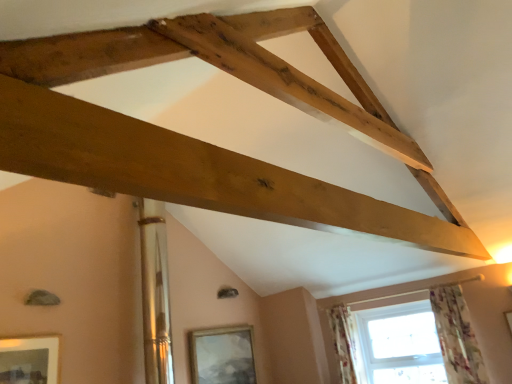
Question: Is floral fabric curtain at lower right, marked as the first curtain in a back-to-front arrangement, located within floral fabric curtain at lower right, the first curtain when ordered from front to back?

Choices:
 (A) yes
 (B) no

Answer: (B)

Question: Can you confirm if floral fabric curtain at lower right, the 1th curtain when ordered from right to left, is taller than floral fabric curtain at lower right, arranged as the second curtain when viewed from the front?

Choices:
 (A) yes
 (B) no

Answer: (A)

Question: From the image's perspective, would you say floral fabric curtain at lower right, the first curtain when ordered from front to back, is shown under floral fabric curtain at lower right, marked as the first curtain in a back-to-front arrangement?

Choices:
 (A) yes
 (B) no

Answer: (B)

Question: Could you tell me if floral fabric curtain at lower right, placed as the 2th curtain when sorted from back to front, is facing floral fabric curtain at lower right, positioned as the second curtain in right-to-left order?

Choices:
 (A) yes
 (B) no

Answer: (B)

Question: Does floral fabric curtain at lower right, placed as the 2th curtain when sorted from back to front, have a greater width compared to floral fabric curtain at lower right, marked as the first curtain in a back-to-front arrangement?

Choices:
 (A) no
 (B) yes

Answer: (A)

Question: Is floral fabric curtain at lower right, placed as the 2th curtain when sorted from back to front, touching floral fabric curtain at lower right, marked as the first curtain in a back-to-front arrangement?

Choices:
 (A) yes
 (B) no

Answer: (B)

Question: Is matte silver picture frame at lower center, acting as the 1th picture frame starting from the bottom, surrounding matte gold picture frame at lower left, the second picture frame from the bottom?

Choices:
 (A) no
 (B) yes

Answer: (A)

Question: From a real-world perspective, is matte silver picture frame at lower center, acting as the 1th picture frame starting from the bottom, positioned under matte gold picture frame at lower left, the first picture frame in the front-to-back sequence, based on gravity?

Choices:
 (A) yes
 (B) no

Answer: (A)

Question: Considering the relative sizes of matte silver picture frame at lower center, positioned as the 1th picture frame in back-to-front order, and matte gold picture frame at lower left, positioned as the 1th picture frame in left-to-right order, in the image provided, is matte silver picture frame at lower center, positioned as the 1th picture frame in back-to-front order, thinner than matte gold picture frame at lower left, positioned as the 1th picture frame in left-to-right order,?

Choices:
 (A) yes
 (B) no

Answer: (B)

Question: Is matte silver picture frame at lower center, which is counted as the 1th picture frame, starting from the right, outside matte gold picture frame at lower left, positioned as the 1th picture frame in left-to-right order?

Choices:
 (A) yes
 (B) no

Answer: (A)

Question: Is there a large distance between matte silver picture frame at lower center, placed as the second picture frame when sorted from front to back, and matte gold picture frame at lower left, which appears as the 2th picture frame when viewed from the back?

Choices:
 (A) yes
 (B) no

Answer: (A)

Question: From a real-world perspective, is matte silver picture frame at lower center, positioned as the 1th picture frame in back-to-front order, positioned over matte gold picture frame at lower left, the second picture frame in the right-to-left sequence, based on gravity?

Choices:
 (A) no
 (B) yes

Answer: (A)

Question: Is matte silver picture frame at lower center, the second picture frame positioned from the left, behind floral fabric curtain at lower right, the first curtain viewed from the left?

Choices:
 (A) no
 (B) yes

Answer: (A)